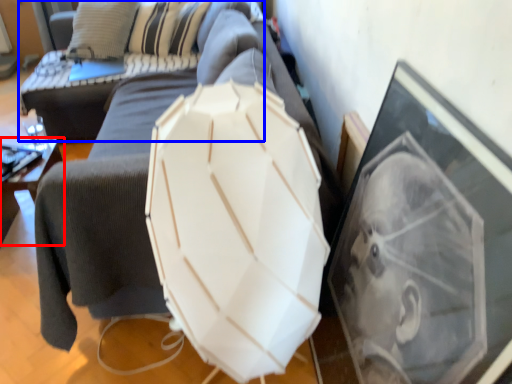
Question: Which object appears farthest to the camera in this image, furniture (highlighted by a red box) or couch (highlighted by a blue box)?

Choices:
 (A) furniture
 (B) couch

Answer: (B)